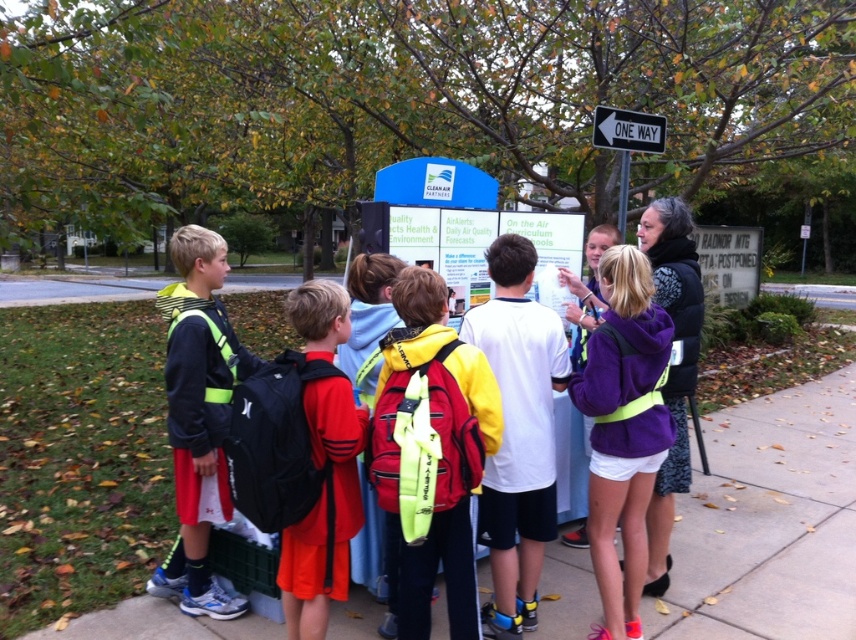
You are a photographer trying to capture a photo of the purple fleece jacket at center and the matte black jacket at left. Since you want both jackets to appear the same size in the photo, where should you position yourself relative to the jackets?

To make the purple fleece jacket at center and the matte black jacket at left appear the same size in the photo, you should move closer to the purple fleece jacket at center since it is smaller than the matte black jacket at left.

Based on the photo, you are standing at the point closest to the display board. Which of the two points, point (613, 387) or point (337, 468), is farther away from you?

Point (613, 387) is behind point (337, 468), so it is farther away from you.